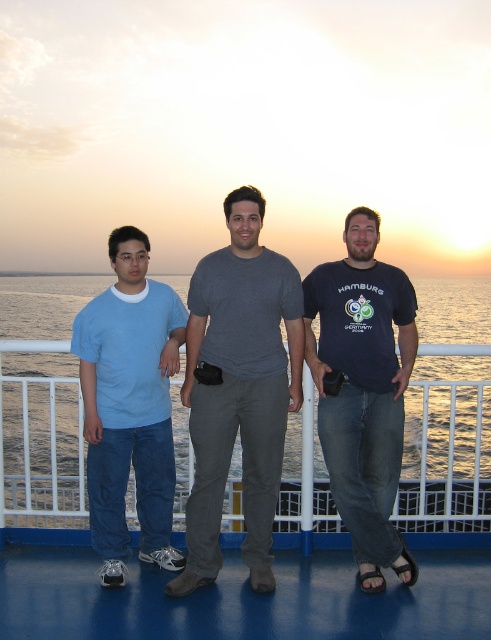
At what (x,y) coordinates should I click in order to perform the action: click on dark blue t-shirt at center. Please return your answer as a coordinate pair (x, y). This screenshot has height=640, width=491. Looking at the image, I should click on (362, 390).

Based on the photo, does dark blue t-shirt at center have a lesser width compared to light blue t-shirt at left?

In fact, dark blue t-shirt at center might be wider than light blue t-shirt at left.

Measure the distance between point [314,378] and camera.

The distance of point [314,378] from camera is 5.31 meters.

This screenshot has width=491, height=640. In order to click on dark blue t-shirt at center in this screenshot , I will do `click(362, 390)`.

Is gray cotton t-shirt at center in front of dark blue t-shirt at center?

Yes, gray cotton t-shirt at center is closer to the viewer.

Is point (211, 540) positioned in front of point (359, 291)?

Yes.

This screenshot has width=491, height=640. I want to click on gray cotton t-shirt at center, so click(239, 388).

Is blue water at center positioned before light blue t-shirt at left?

No, it is behind light blue t-shirt at left.

Which is behind, point (15, 326) or point (106, 332)?

The point (15, 326) is more distant.

Find the location of `blue water at center`. blue water at center is located at coordinates (445, 442).